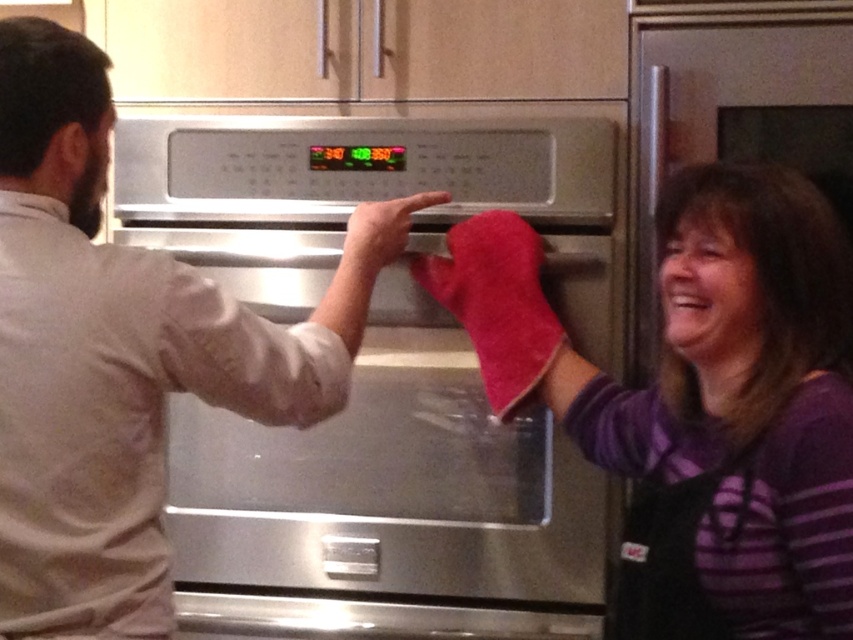
In the scene shown: Who is taller, stainless steel oven at center or red cotton oven mitt at center?

Standing taller between the two is stainless steel oven at center.

The width and height of the screenshot is (853, 640). Identify the location of stainless steel oven at center. (381, 356).

Is stainless steel oven at center thinner than matte white shirt at left?

No, stainless steel oven at center is not thinner than matte white shirt at left.

Is stainless steel oven at center above matte white shirt at left?

Incorrect, stainless steel oven at center is not positioned above matte white shirt at left.

The image size is (853, 640). Find the location of `stainless steel oven at center`. stainless steel oven at center is located at coordinates (381, 356).

This screenshot has height=640, width=853. I want to click on stainless steel oven at center, so click(x=381, y=356).

Is matte white shirt at left positioned in front of red cotton oven mitt at center?

No, it is behind red cotton oven mitt at center.

In the scene shown: Between matte white shirt at left and red cotton oven mitt at center, which one appears on the left side from the viewer's perspective?

Positioned to the left is matte white shirt at left.

In order to click on matte white shirt at left in this screenshot , I will do `click(123, 355)`.

You are a GUI agent. You are given a task and a screenshot of the screen. Output one action in this format:
    pyautogui.click(x=<x>, y=<y>)
    Task: Click on the matte white shirt at left
    The image size is (853, 640).
    Given the screenshot: What is the action you would take?
    pyautogui.click(x=123, y=355)